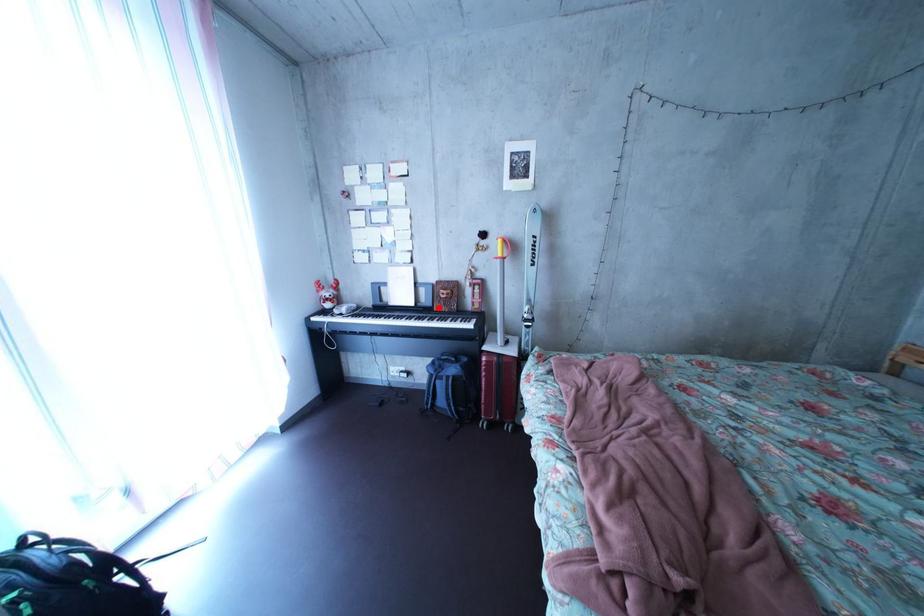
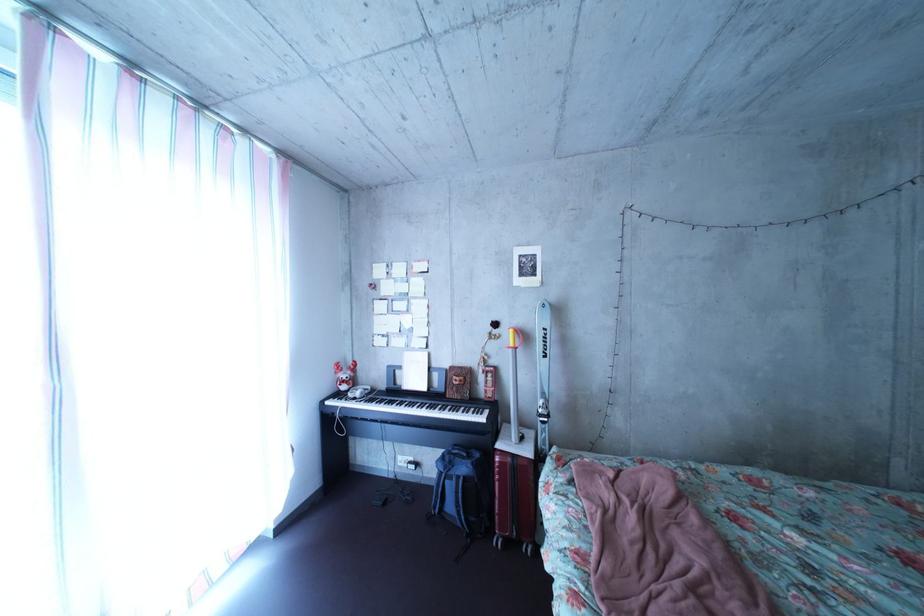
Locate, in the second image, the point that corresponds to the highlighted location in the first image.

(452, 392)